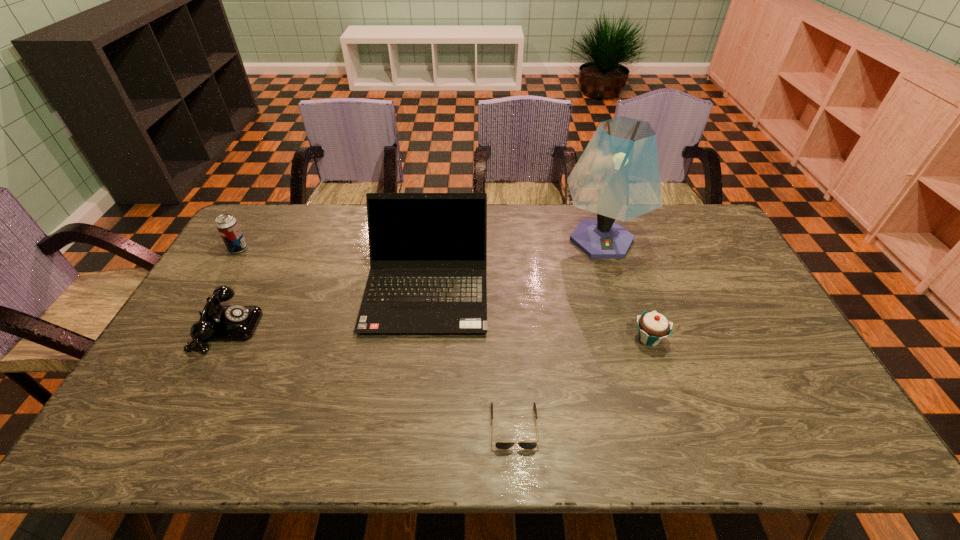
You are a GUI agent. You are given a task and a screenshot of the screen. Output one action in this format:
    pyautogui.click(x=<x>, y=<y>)
    Task: Click on the blank region between the telephone and the fifth shortest object
    This screenshot has width=960, height=540.
    Given the screenshot: What is the action you would take?
    pyautogui.click(x=327, y=308)

At what (x,y) coordinates should I click in order to perform the action: click on vacant area between the beer can and the laptop computer. Please return your answer as a coordinate pair (x, y). The height and width of the screenshot is (540, 960). Looking at the image, I should click on (333, 268).

Find the location of a particular element. The height and width of the screenshot is (540, 960). object identified as the third closest to the tallest object is located at coordinates (499, 445).

Locate which object ranks fourth in proximity to the cupcake. Please provide its 2D coordinates. Your answer should be formatted as a tuple, i.e. [(x, y)], where the tuple contains the x and y coordinates of a point satisfying the conditions above.

[(217, 322)]

At what (x,y) coordinates should I click in order to perform the action: click on free space in the image that satisfies the following two spatial constraints: 1. on the base of the lampshade; 2. on the right side of the cupcake. Please return your answer as a coordinate pair (x, y). Looking at the image, I should click on (633, 339).

What are the coordinates of `free space that satisfies the following two spatial constraints: 1. on the dial of the cupcake; 2. on the left side of the telephone` in the screenshot? It's located at (222, 339).

You are a GUI agent. You are given a task and a screenshot of the screen. Output one action in this format:
    pyautogui.click(x=<x>, y=<y>)
    Task: Click on the free spot that satisfies the following two spatial constraints: 1. on the base of the tallest object; 2. on the right side of the cupcake
    
    Given the screenshot: What is the action you would take?
    pyautogui.click(x=633, y=339)

What are the coordinates of `free spot that satisfies the following two spatial constraints: 1. on the screen of the fourth object from right to left; 2. on the dial of the telephone` in the screenshot? It's located at (422, 328).